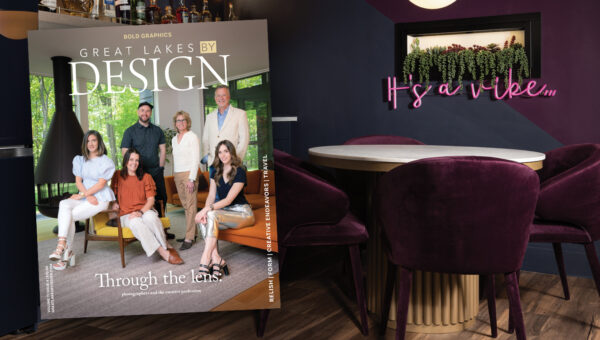
Locate an element on the screen. The image size is (600, 340). liquor bottoles is located at coordinates (168, 15), (184, 12), (193, 14), (206, 16), (232, 15), (144, 9), (127, 9), (94, 12), (53, 1).